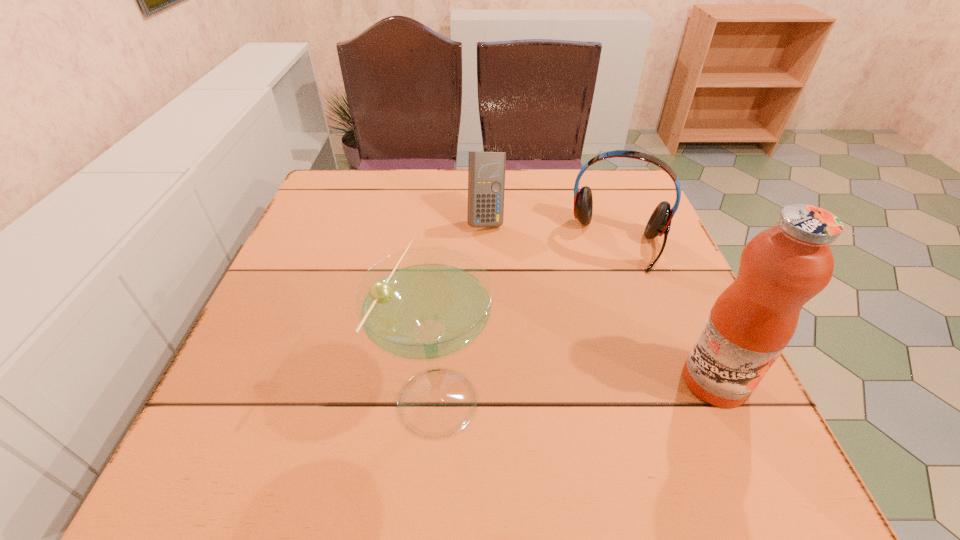
Image resolution: width=960 pixels, height=540 pixels. I want to click on vacant spot on the desktop that is between the third shortest object and the fruit juice and is positioned on the front-facing side of the calculator, so click(x=550, y=389).

Where is `free space on the desktop that is between the martini and the fruit juice and is positioned with the microphone attached to the side of the headset`? free space on the desktop that is between the martini and the fruit juice and is positioned with the microphone attached to the side of the headset is located at coordinates (586, 388).